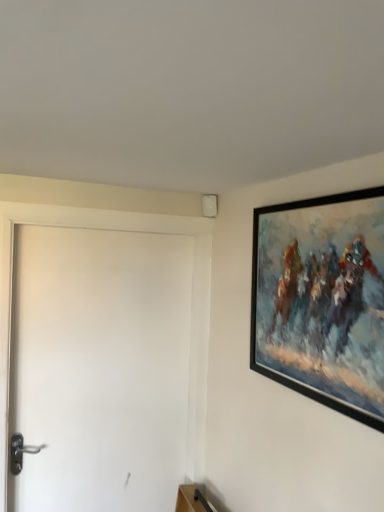
Question: Based on their sizes in the image, would you say white matte door at left is bigger or smaller than black matte picture frame at upper right?

Choices:
 (A) small
 (B) big

Answer: (B)

Question: From the image's perspective, relative to black matte picture frame at upper right, is white matte door at left above or below?

Choices:
 (A) above
 (B) below

Answer: (B)

Question: In the image, is white matte door at left on the left side or the right side of black matte picture frame at upper right?

Choices:
 (A) right
 (B) left

Answer: (B)

Question: From a real-world perspective, is black matte picture frame at upper right above or below white matte door at left?

Choices:
 (A) below
 (B) above

Answer: (B)

Question: From their relative heights in the image, would you say black matte picture frame at upper right is taller or shorter than white matte door at left?

Choices:
 (A) tall
 (B) short

Answer: (B)

Question: In terms of size, does black matte picture frame at upper right appear bigger or smaller than white matte door at left?

Choices:
 (A) big
 (B) small

Answer: (B)

Question: From the image's perspective, relative to white matte door at left, is black matte picture frame at upper right above or below?

Choices:
 (A) above
 (B) below

Answer: (A)